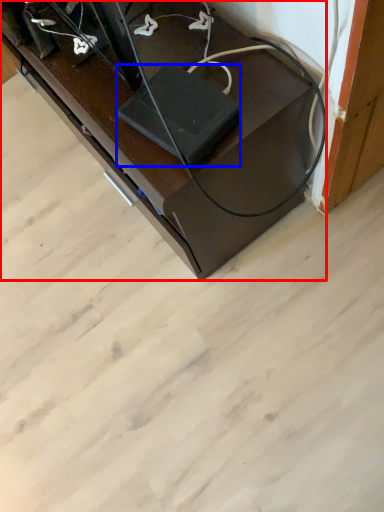
Question: Which object appears closest to the camera in this image, furniture (highlighted by a red box) or wide (highlighted by a blue box)?

Choices:
 (A) furniture
 (B) wide

Answer: (B)